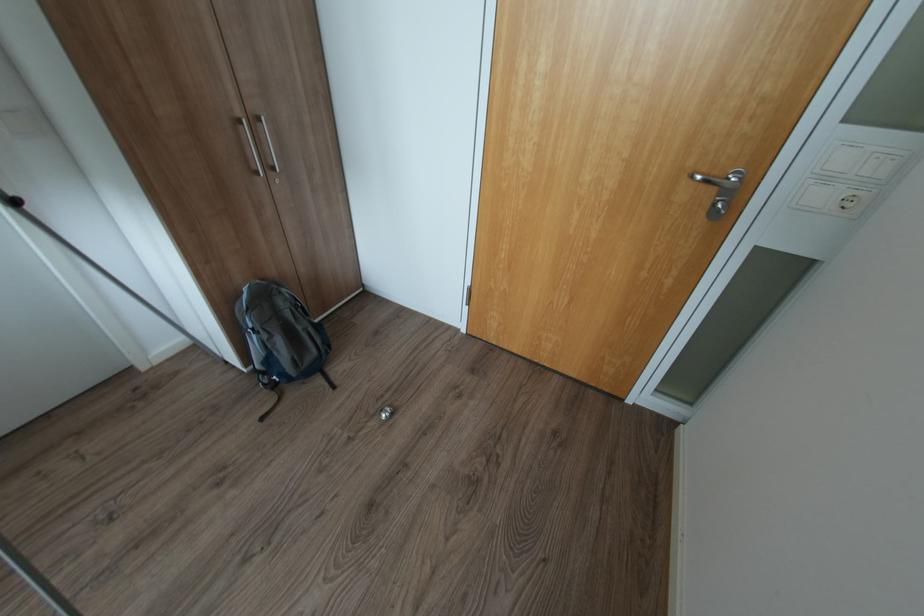
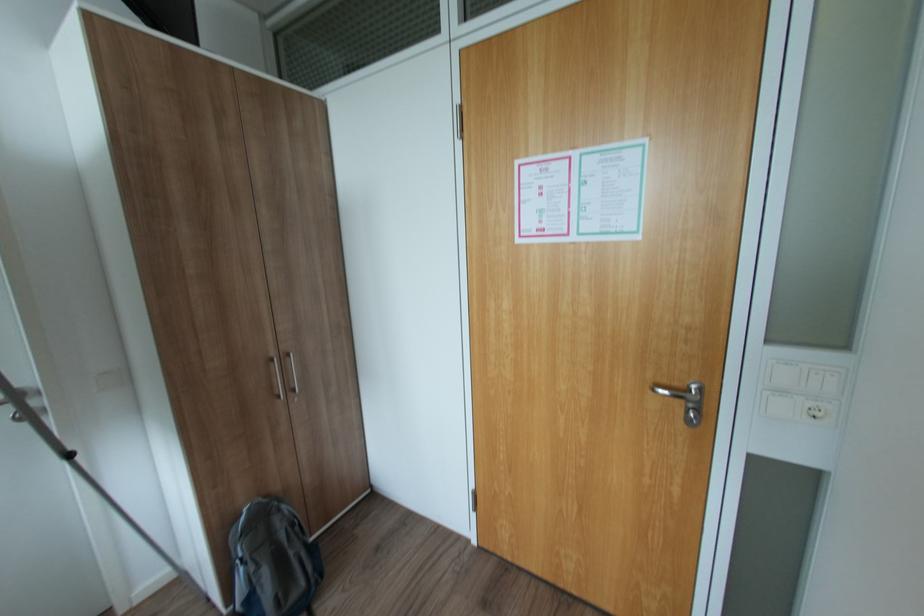
Find the pixel in the second image that matches [262,366] in the first image.

(244, 608)